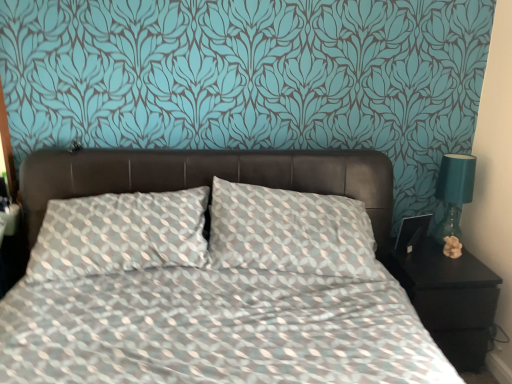
In order to click on blank space situated above black glossy nightstand at lower right (from a real-world perspective) in this screenshot , I will do `click(430, 262)`.